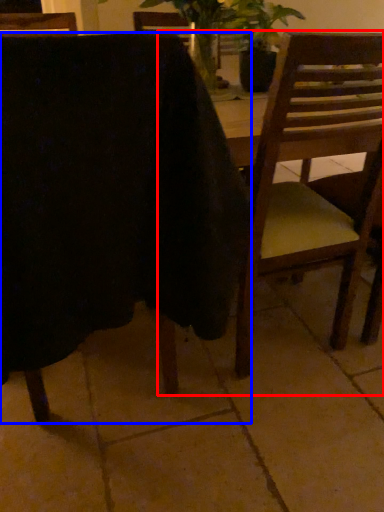
Question: Which point is further to the camera, chair (highlighted by a red box) or chair (highlighted by a blue box)?

Choices:
 (A) chair
 (B) chair

Answer: (A)